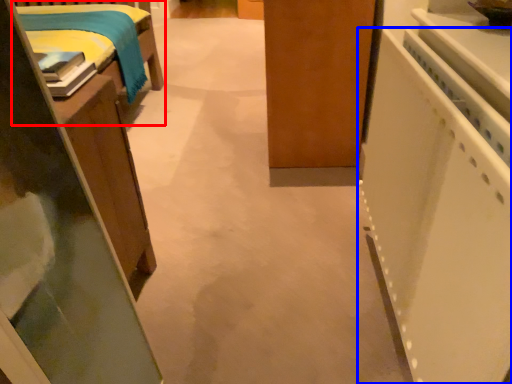
Question: Which of the following is the farthest to the observer, furniture (highlighted by a red box) or appliance (highlighted by a blue box)?

Choices:
 (A) furniture
 (B) appliance

Answer: (A)